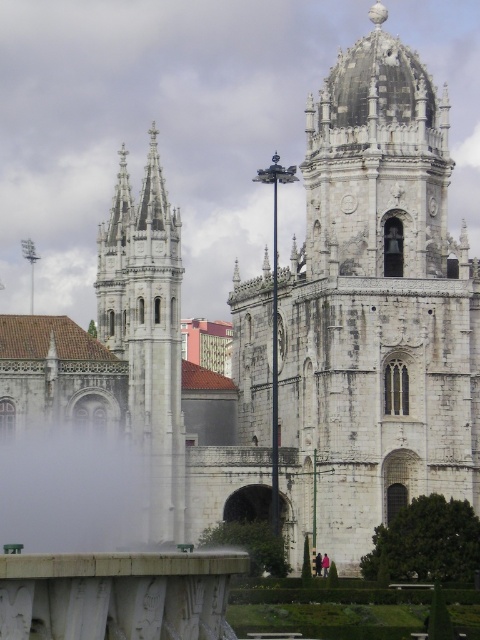
Which is behind, point (108, 260) or point (96, 477)?

Point (108, 260)

Does white stone tower at left appear on the left side of white fog at lower center?

No, white stone tower at left is not to the left of white fog at lower center.

Is point (151, 340) positioned in front of point (75, 480)?

No, (151, 340) is further to viewer.

At what (x,y) coordinates should I click in order to perform the action: click on white stone tower at left. Please return your answer as a coordinate pair (x, y). Looking at the image, I should click on (146, 332).